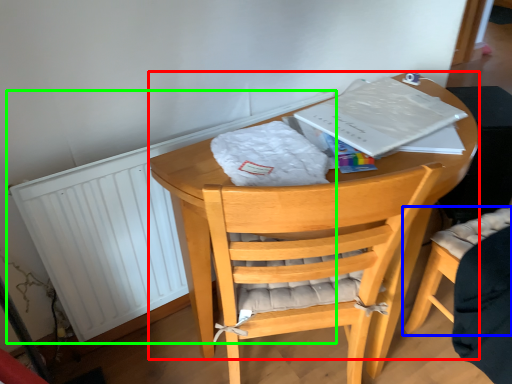
Question: Considering the real-world distances, which object is farthest from round table (highlighted by a red box)? chair (highlighted by a blue box) or radiator (highlighted by a green box)?

Choices:
 (A) chair
 (B) radiator

Answer: (A)